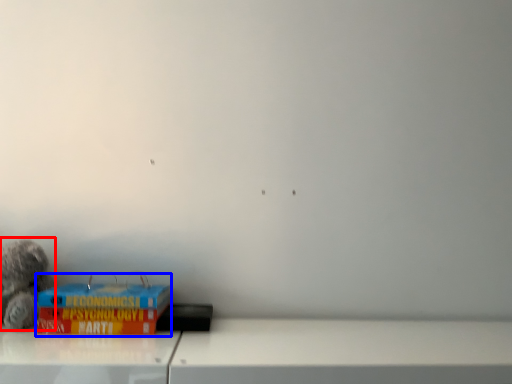
Question: Which object is further to the camera taking this photo, toy (highlighted by a red box) or paperback book (highlighted by a blue box)?

Choices:
 (A) toy
 (B) paperback book

Answer: (A)